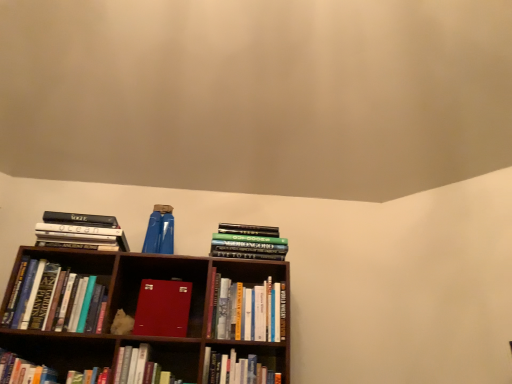
Question: Is hardcover books at left, which is the 8th book from right to left, thinner than hardcover book at lower left, which ranks as the 2th book in left-to-right order?

Choices:
 (A) no
 (B) yes

Answer: (B)

Question: From a real-world perspective, does hardcover books at left, which appears as the 1th book when viewed from the left, stand above hardcover book at lower left, which ranks as the 2th book in left-to-right order?

Choices:
 (A) yes
 (B) no

Answer: (A)

Question: Is hardcover books at left, which is the 8th book from right to left, next to hardcover book at lower left, which is the 7th book in right-to-left order?

Choices:
 (A) no
 (B) yes

Answer: (A)

Question: Does hardcover books at left, which is the 8th book from right to left, have a lesser height compared to hardcover book at lower left, which is the 7th book in right-to-left order?

Choices:
 (A) yes
 (B) no

Answer: (B)

Question: From a real-world perspective, is hardcover books at left, which appears as the 1th book when viewed from the left, positioned under hardcover book at lower left, which ranks as the 2th book in left-to-right order, based on gravity?

Choices:
 (A) yes
 (B) no

Answer: (B)

Question: Is hardcover books at left, which is the 8th book from right to left, positioned with its back to hardcover book at lower left, which ranks as the 2th book in left-to-right order?

Choices:
 (A) yes
 (B) no

Answer: (B)

Question: From a real-world perspective, does hardcover book at lower left, which is the 7th book in right-to-left order, stand above hardcover book at lower center, arranged as the fourth book when viewed from the right?

Choices:
 (A) no
 (B) yes

Answer: (A)

Question: Is hardcover book at lower left, which ranks as the 2th book in left-to-right order, thinner than hardcover book at lower center, arranged as the fourth book when viewed from the right?

Choices:
 (A) yes
 (B) no

Answer: (A)

Question: Can you confirm if hardcover book at lower left, which ranks as the 2th book in left-to-right order, is positioned to the right of hardcover book at lower center, placed as the 5th book when sorted from left to right?

Choices:
 (A) no
 (B) yes

Answer: (A)

Question: Can you confirm if hardcover book at lower left, which ranks as the 2th book in left-to-right order, is positioned to the left of hardcover book at lower center, arranged as the fourth book when viewed from the right?

Choices:
 (A) no
 (B) yes

Answer: (B)

Question: Is hardcover book at lower left, which is the 7th book in right-to-left order, positioned far away from hardcover book at lower center, placed as the 5th book when sorted from left to right?

Choices:
 (A) yes
 (B) no

Answer: (B)

Question: Can you confirm if hardcover book at lower left, which ranks as the 2th book in left-to-right order, is taller than hardcover book at lower center, arranged as the fourth book when viewed from the right?

Choices:
 (A) yes
 (B) no

Answer: (B)

Question: Does hardcover book at lower left, which is the 7th book in right-to-left order, appear on the left side of hardcover book at lower center, the 3th book from the right?

Choices:
 (A) no
 (B) yes

Answer: (B)